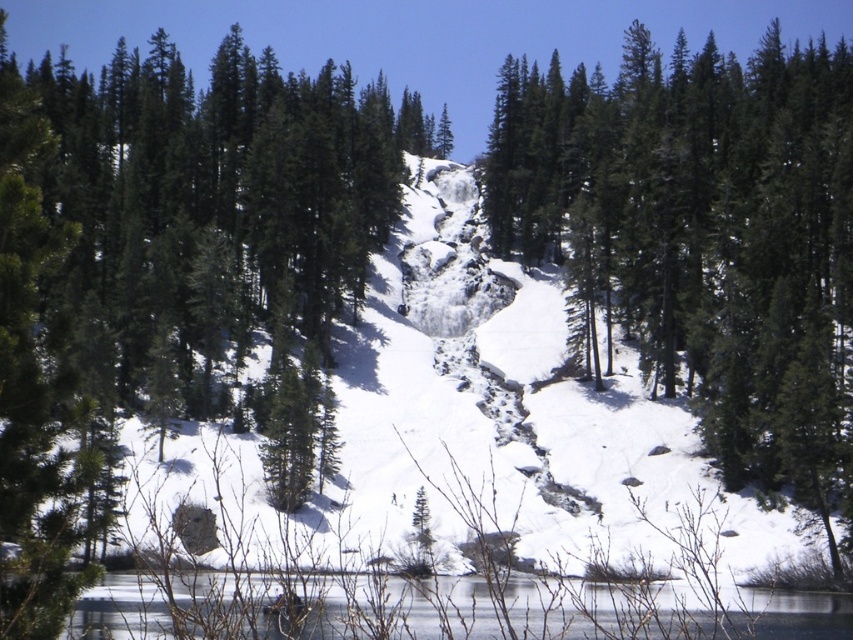
Does green matte tree at center come in front of clear ice lake at lower center?

No, it is not.

What do you see at coordinates (701, 237) in the screenshot? Image resolution: width=853 pixels, height=640 pixels. I see `green matte tree at center` at bounding box center [701, 237].

The image size is (853, 640). In order to click on green matte tree at center in this screenshot , I will do `click(701, 237)`.